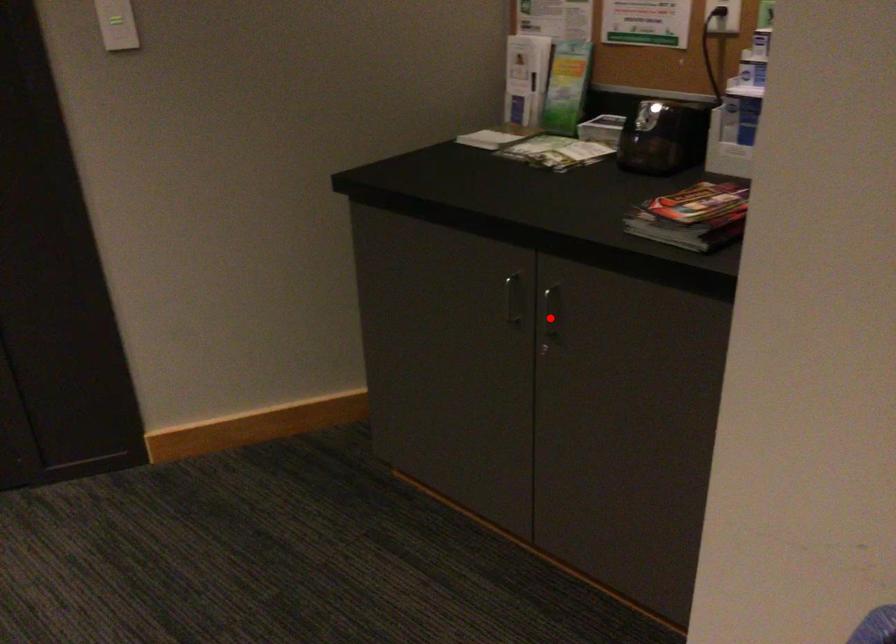
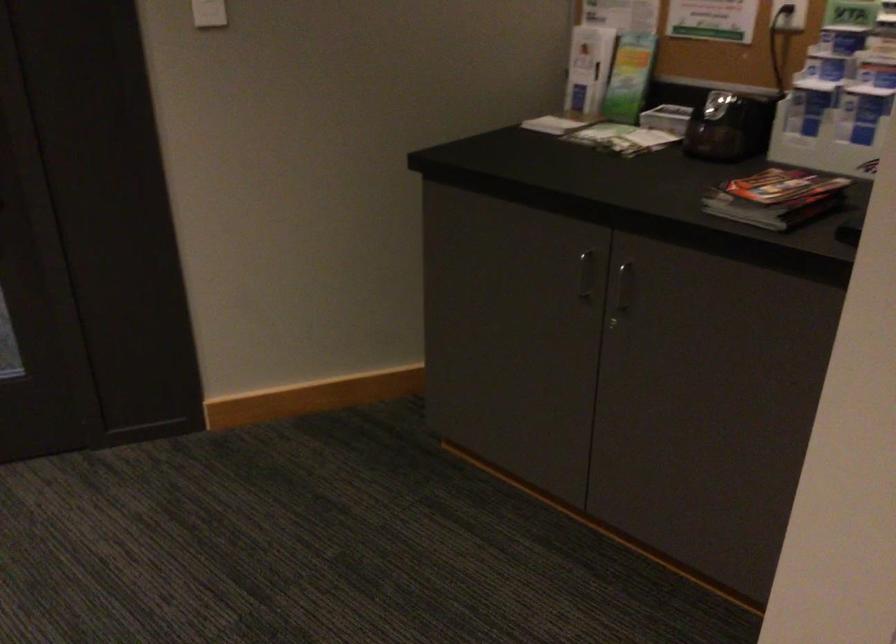
Question: I am providing you with two images of the same scene from different viewpoints. A red point is marked on the first image. Is the red point's position out of view in image 2?

Choices:
 (A) Yes
 (B) No

Answer: (B)